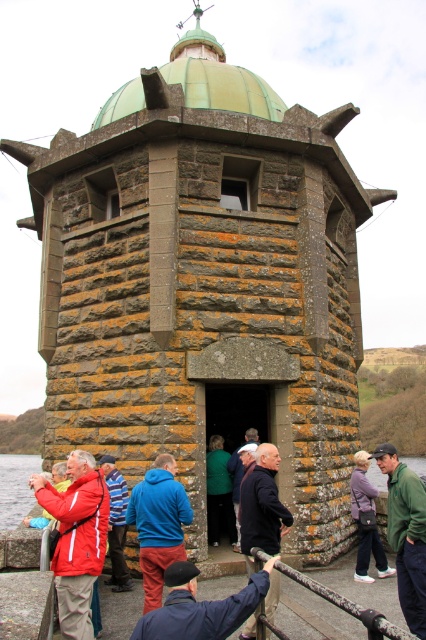
Does point (357, 522) lie in front of point (222, 502)?

Yes, it is in front of point (222, 502).

Does purple fleece jacket at center come in front of green matte jacket at center?

Yes, purple fleece jacket at center is in front of green matte jacket at center.

Between point (365, 544) and point (212, 456), which one is positioned in front?

Positioned in front is point (365, 544).

At what (x,y) coordinates should I click in order to perform the action: click on purple fleece jacket at center. Please return your answer as a coordinate pair (x, y). The image size is (426, 640). Looking at the image, I should click on (365, 525).

Who is more forward, (196,572) or (11,496)?

Positioned in front is point (196,572).

Is point (238, 600) positioned behind point (14, 492)?

No.

Is point (140, 621) more distant than point (28, 486)?

No, (140, 621) is closer to viewer.

At what (x,y) coordinates should I click in order to perform the action: click on blue fabric jacket at center. Please return your answer as a coordinate pair (x, y). Looking at the image, I should click on (201, 605).

Does point (365, 499) come farther from viewer compared to point (311, 580)?

Yes, point (365, 499) is farther from viewer.

Which is in front, point (359, 547) or point (255, 547)?

Point (255, 547)

This screenshot has height=640, width=426. I want to click on purple fleece jacket at center, so [365, 525].

The height and width of the screenshot is (640, 426). What are the coordinates of `purple fleece jacket at center` in the screenshot? It's located at (365, 525).